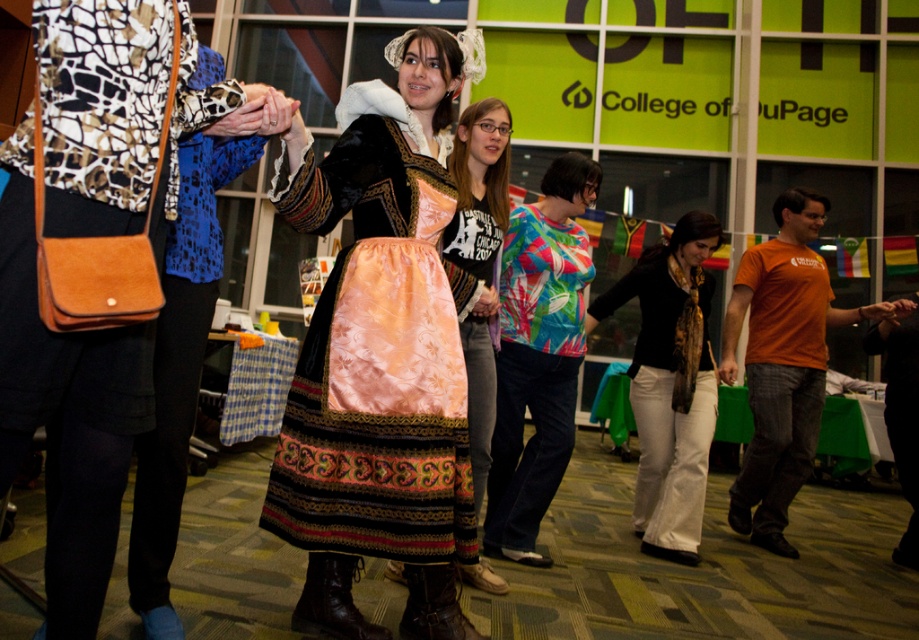
Question: Can you confirm if printed fabric shirt at center is positioned below silk satin dress at center?

Choices:
 (A) no
 (B) yes

Answer: (B)

Question: Is matte black purse at left wider than printed fabric shirt at center?

Choices:
 (A) yes
 (B) no

Answer: (A)

Question: Does silk satin dress at center have a lesser width compared to brown leather boot at lower center?

Choices:
 (A) yes
 (B) no

Answer: (A)

Question: Which point is closer to the camera taking this photo?

Choices:
 (A) (103, 77)
 (B) (644, 300)
 (C) (508, 362)

Answer: (A)

Question: Which object appears closest to the camera in this image?

Choices:
 (A) leather boot at lower center
 (B) silk satin dress at center
 (C) satin dress at center
 (D) matte black purse at left

Answer: (D)

Question: Which point appears closest to the camera in this image?

Choices:
 (A) (674, 304)
 (B) (497, 476)

Answer: (B)